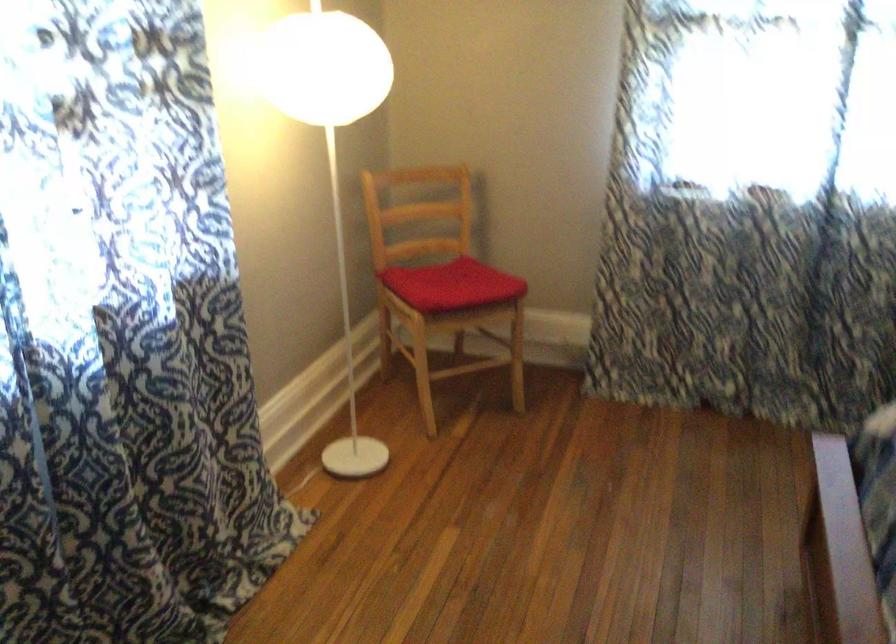
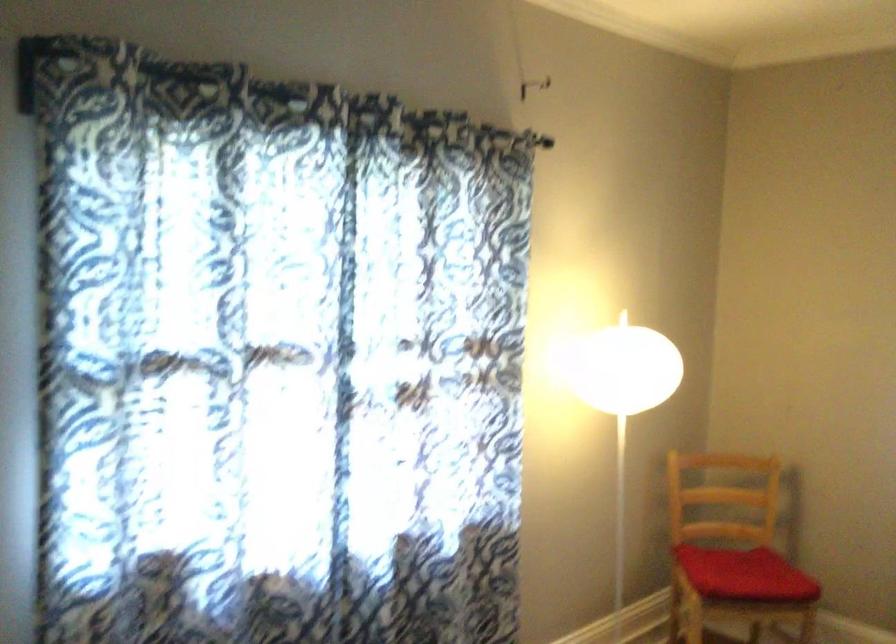
Find the pixel in the second image that matches point (454, 295) in the first image.

(745, 574)